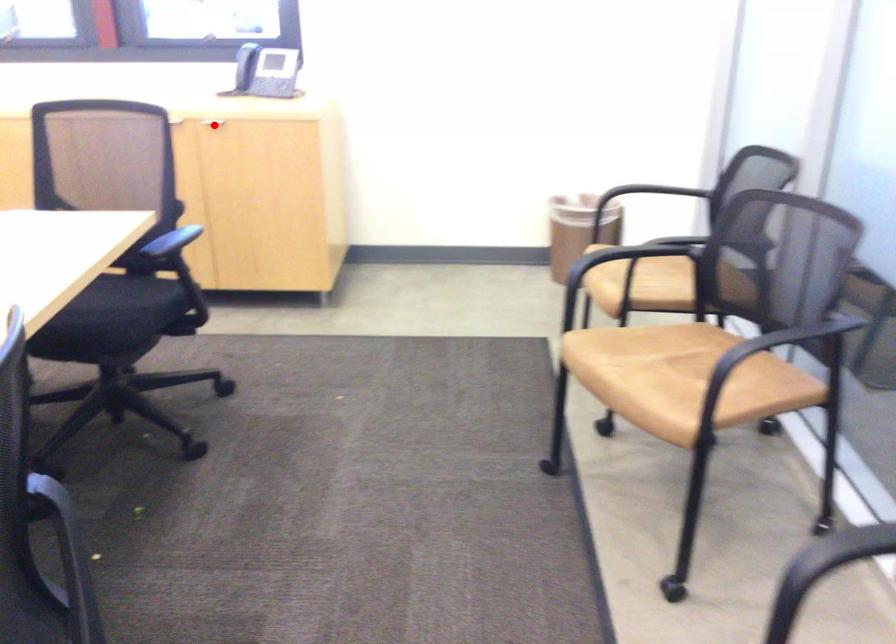
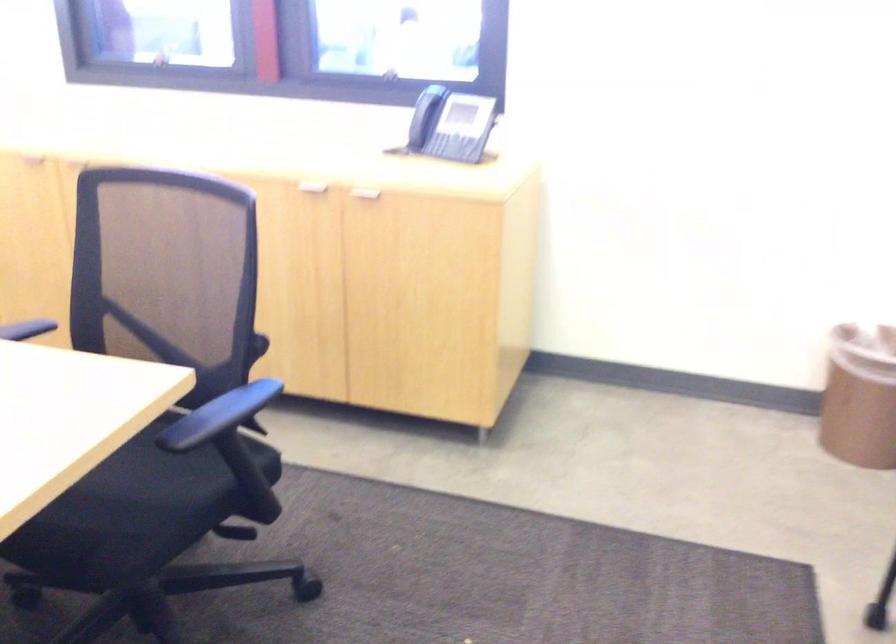
In the second image, find the point that corresponds to the highlighted location in the first image.

(364, 196)